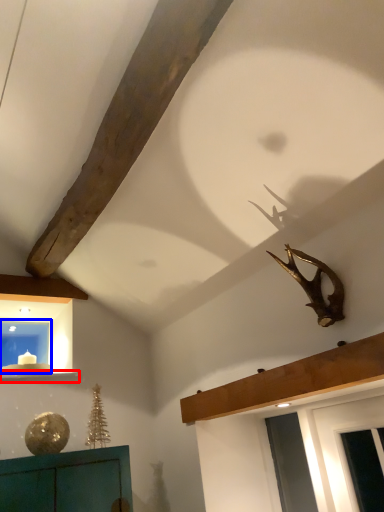
Question: Which object is further to the camera taking this photo, window sill (highlighted by a red box) or window (highlighted by a blue box)?

Choices:
 (A) window sill
 (B) window

Answer: (B)